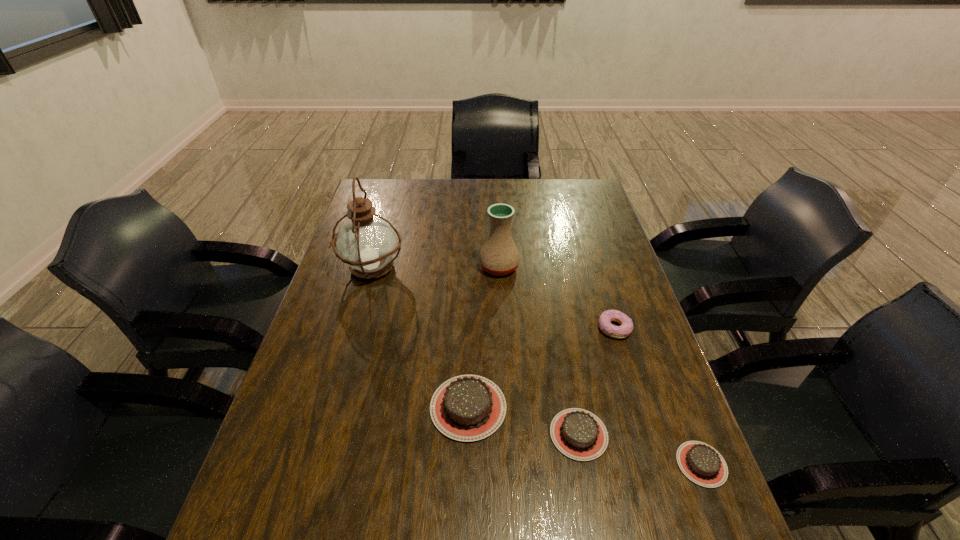
The width and height of the screenshot is (960, 540). Identify the location of object situated at the near right corner. (702, 464).

Locate an element on the screen. This screenshot has height=540, width=960. free space at the far edge of the desktop is located at coordinates (519, 201).

This screenshot has height=540, width=960. What are the coordinates of `vacant area at the near edge of the desktop` in the screenshot? It's located at (540, 491).

Locate an element on the screen. free space at the left edge of the desktop is located at coordinates (276, 443).

At what (x,y) coordinates should I click in order to perform the action: click on vacant space at the right edge of the desktop. Please return your answer as a coordinate pair (x, y). The image size is (960, 540). Looking at the image, I should click on (656, 345).

What are the coordinates of `vacant space at the near left corner of the desktop` in the screenshot? It's located at (253, 510).

At what (x,y) coordinates should I click in order to perform the action: click on free spot at the far right corner of the desktop. Please return your answer as a coordinate pair (x, y). This screenshot has width=960, height=540. Looking at the image, I should click on (570, 194).

At what (x,y) coordinates should I click in order to perform the action: click on empty location between the second chocolate cake from left to right and the leftmost object. Please return your answer as a coordinate pair (x, y). Image resolution: width=960 pixels, height=540 pixels. Looking at the image, I should click on (475, 352).

What are the coordinates of `empty location between the tallest object and the rightmost chocolate cake` in the screenshot? It's located at (x=537, y=366).

At what (x,y) coordinates should I click in order to perform the action: click on empty space between the oil lamp and the shortest object. Please return your answer as a coordinate pair (x, y). Image resolution: width=960 pixels, height=540 pixels. Looking at the image, I should click on (537, 366).